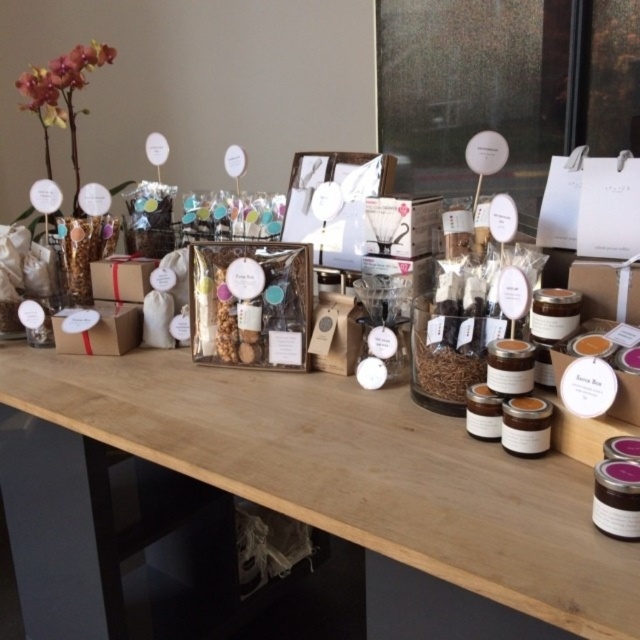
Between wooden table at center and translucent glass jar at center, which one appears on the right side from the viewer's perspective?

translucent glass jar at center is more to the right.

Between point (276, 406) and point (438, 401), which one is positioned behind?

The point (276, 406) is behind.

Locate an element on the screen. This screenshot has height=640, width=640. wooden table at center is located at coordinates (362, 472).

Between point (444, 426) and point (595, 355), which one is positioned behind?

The point (444, 426) is more distant.

Identify the location of wooden table at center. (362, 472).

Who is lower down, translucent glass jar at center or matte brown jar at center?

Positioned lower is translucent glass jar at center.

Who is shorter, translucent glass jar at center or matte brown jar at center?

matte brown jar at center is shorter.

Who is more forward, (483,371) or (572,348)?

Point (572,348) is in front.

Locate an element on the screen. translucent glass jar at center is located at coordinates (442, 374).